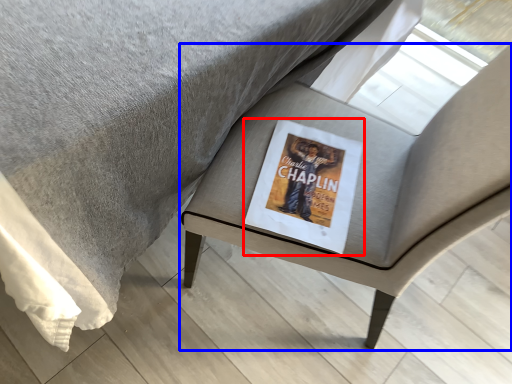
Question: Which object is further to the camera taking this photo, paperback book (highlighted by a red box) or chair (highlighted by a blue box)?

Choices:
 (A) paperback book
 (B) chair

Answer: (A)